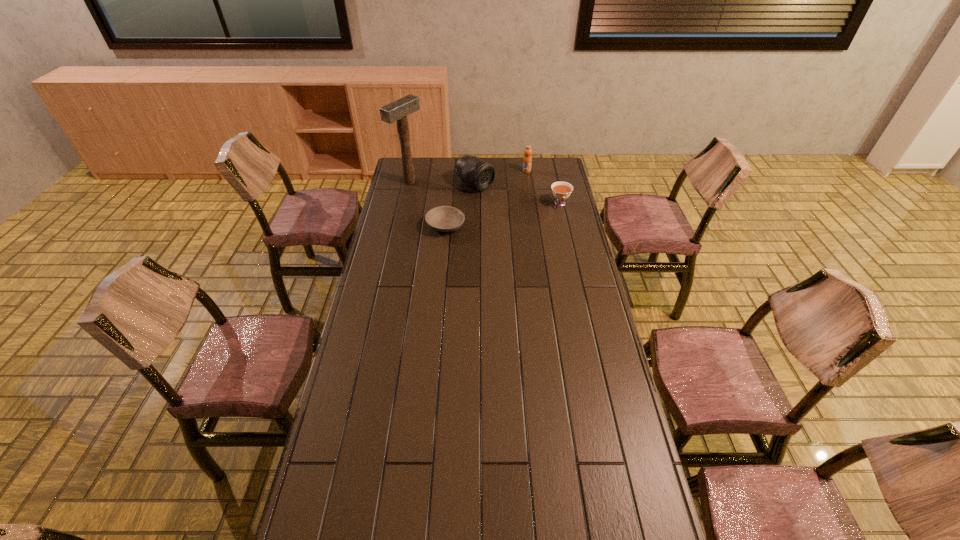
The height and width of the screenshot is (540, 960). Identify the location of unoccupied position between the orange juice and the nearest object. (486, 199).

The image size is (960, 540). Find the location of `free space between the second object from right to left and the telephoto lens`. free space between the second object from right to left and the telephoto lens is located at coordinates (501, 178).

Image resolution: width=960 pixels, height=540 pixels. What are the coordinates of `empty location between the shortest object and the fourth object from left to right` in the screenshot? It's located at (486, 199).

Find the location of a particular element. free spot between the telephoto lens and the tallest object is located at coordinates (443, 183).

This screenshot has height=540, width=960. I want to click on vacant area between the rightmost object and the tallest object, so click(x=485, y=193).

Locate an element on the screen. This screenshot has height=540, width=960. unoccupied area between the telephoto lens and the second object from right to left is located at coordinates (501, 178).

At what (x,y) coordinates should I click in order to perform the action: click on vacant area that lies between the fourth tallest object and the tallest object. Please return your answer as a coordinate pair (x, y). This screenshot has width=960, height=540. Looking at the image, I should click on (485, 193).

Image resolution: width=960 pixels, height=540 pixels. I want to click on free spot between the fourth object from left to right and the second nearest object, so click(x=543, y=187).

This screenshot has height=540, width=960. I want to click on vacant space that's between the tallest object and the second shortest object, so click(x=485, y=193).

Identify which object is the third nearest to the nearest object. Please provide its 2D coordinates. Your answer should be formatted as a tuple, i.e. [(x, y)], where the tuple contains the x and y coordinates of a point satisfying the conditions above.

[(561, 190)]